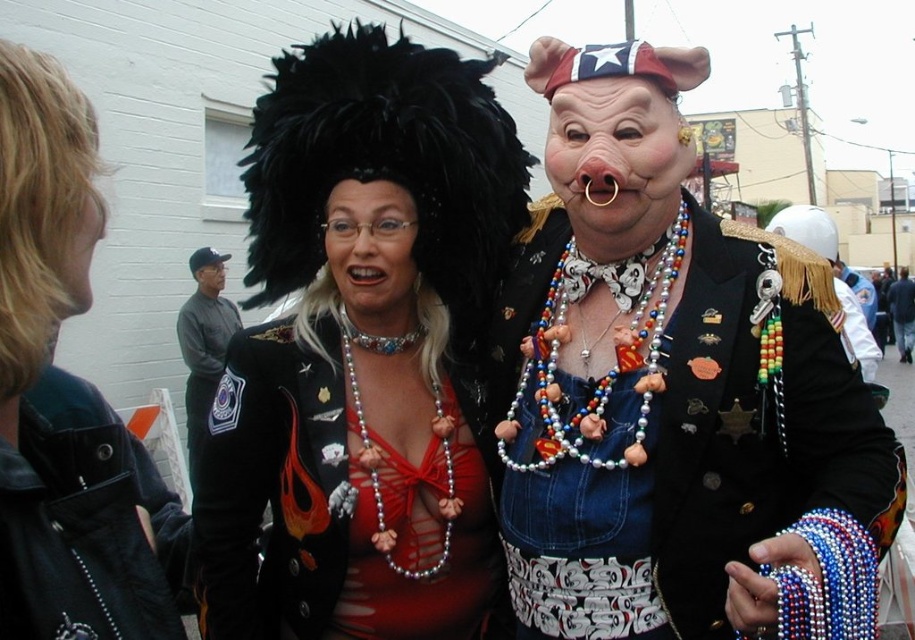
You are standing in a festive setting and want to take a photo of the point at coordinates (x=682, y=298). If your camera has a maximum focus range of 7 meters, will it be able to focus on that point?

The distance of point (x=682, y=298) from the camera is 6.87 meters, which is within the camera maximum focus range of 7 meters. So yes, the camera can focus on that point.